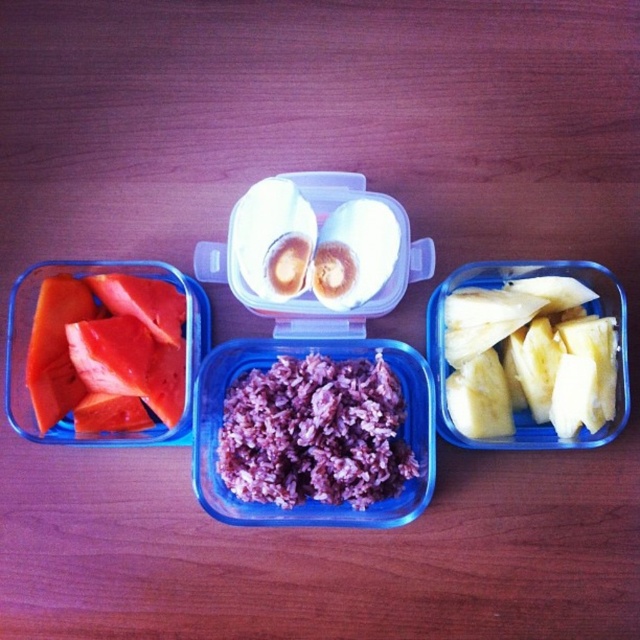
Is point (282, 420) in front of point (99, 291)?

Yes, it is in front of point (99, 291).

Does purple matte rice at center come in front of smooth red tomato slices at left?

No, purple matte rice at center is behind smooth red tomato slices at left.

At what (x,y) coordinates should I click in order to perform the action: click on purple matte rice at center. Please return your answer as a coordinate pair (x, y). The width and height of the screenshot is (640, 640). Looking at the image, I should click on click(x=314, y=433).

Does translucent plastic container at left appear over smooth red tomato slices at left?

Yes, translucent plastic container at left is above smooth red tomato slices at left.

Is translucent plastic container at left behind smooth red tomato slices at left?

No, it is in front of smooth red tomato slices at left.

Describe the element at coordinates (188, 346) in the screenshot. I see `translucent plastic container at left` at that location.

The width and height of the screenshot is (640, 640). In order to click on translucent plastic container at left in this screenshot , I will do click(x=188, y=346).

Is translucent plastic container at left shorter than yellow smooth pineapple at right?

In fact, translucent plastic container at left may be taller than yellow smooth pineapple at right.

Consider the image. Is translucent plastic container at left closer to the viewer compared to yellow smooth pineapple at right?

Yes, translucent plastic container at left is closer to the viewer.

Is point (413, 266) farther from viewer compared to point (609, 355)?

Yes, point (413, 266) is farther from viewer.

I want to click on translucent plastic container at left, so click(188, 346).